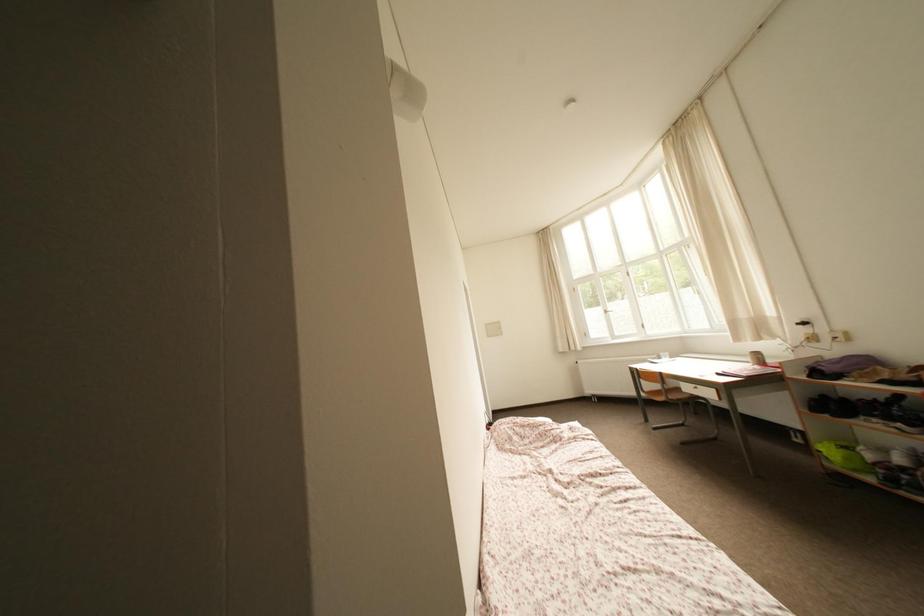
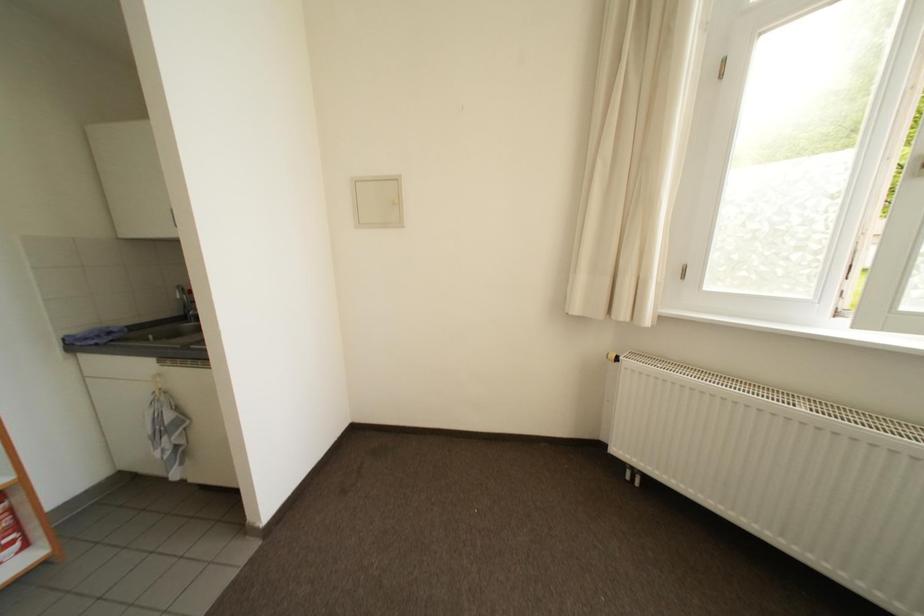
Which direction would the cameraman need to move to produce the second image?

The movement direction of the cameraman is right, forward.